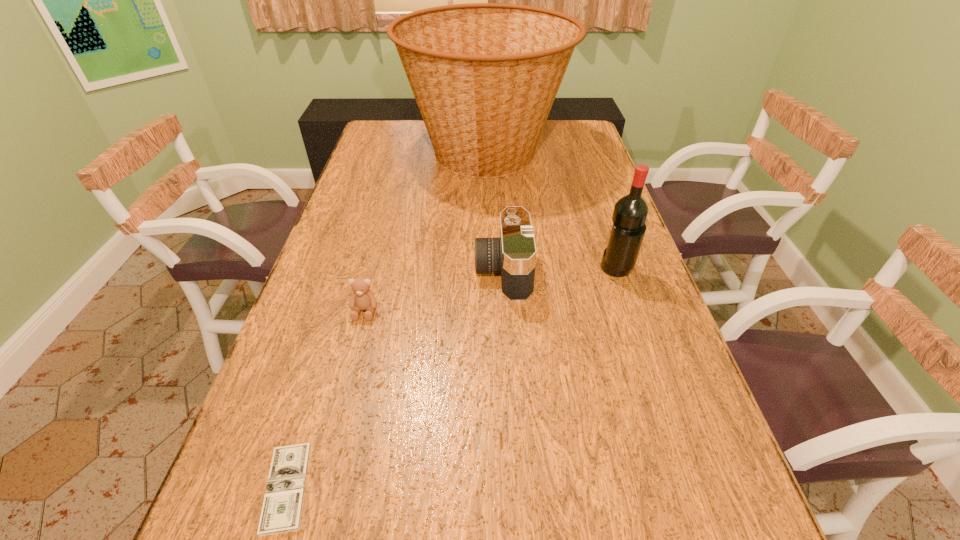
Where is `vacant area that lies between the fourth shortest object and the farthest object`? The height and width of the screenshot is (540, 960). vacant area that lies between the fourth shortest object and the farthest object is located at coordinates (551, 212).

The width and height of the screenshot is (960, 540). I want to click on free space between the third tallest object and the teddy bear, so click(434, 291).

Where is `unoccupied area between the camera and the basket`? The width and height of the screenshot is (960, 540). unoccupied area between the camera and the basket is located at coordinates (494, 212).

This screenshot has height=540, width=960. What are the coordinates of `free space between the farthest object and the wine bottle` in the screenshot? It's located at (551, 212).

The image size is (960, 540). I want to click on vacant point located between the farthest object and the nearest object, so click(386, 321).

The image size is (960, 540). Find the location of `object that stands as the third closest to the camera`. object that stands as the third closest to the camera is located at coordinates (362, 298).

Identify the location of object that is the closest to the second tallest object. The image size is (960, 540). (513, 254).

Where is `vacant space that satisfies the following two spatial constraints: 1. on the front-facing side of the third tallest object; 2. on the back side of the wine bottle`? vacant space that satisfies the following two spatial constraints: 1. on the front-facing side of the third tallest object; 2. on the back side of the wine bottle is located at coordinates (502, 271).

Locate an element on the screen. The width and height of the screenshot is (960, 540). blank area in the image that satisfies the following two spatial constraints: 1. on the back side of the wine bottle; 2. on the front-facing side of the camera is located at coordinates (x=616, y=271).

Identify the location of free space in the image that satisfies the following two spatial constraints: 1. on the front-facing side of the camera; 2. on the face of the teddy bear. The width and height of the screenshot is (960, 540). (505, 311).